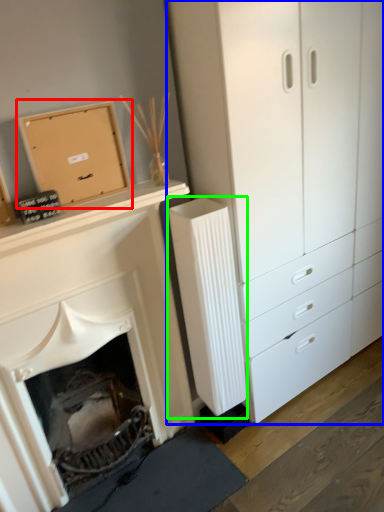
Question: Estimate the real-world distances between objects in this image. Which object is farther from cardboard box (highlighted by a red box), chest of drawers (highlighted by a blue box) or radiator (highlighted by a green box)?

Choices:
 (A) chest of drawers
 (B) radiator

Answer: (A)